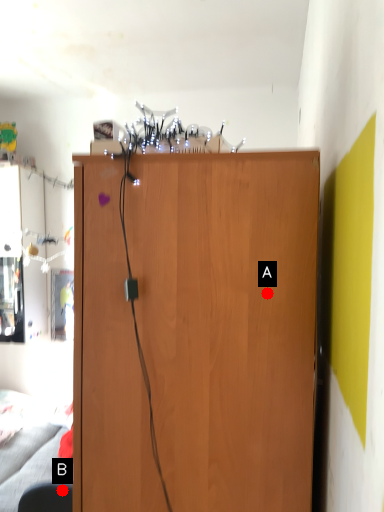
Question: Two points are circled on the image, labeled by A and B beside each circle. Which point is farther to the camera?

Choices:
 (A) A is further
 (B) B is further

Answer: (B)